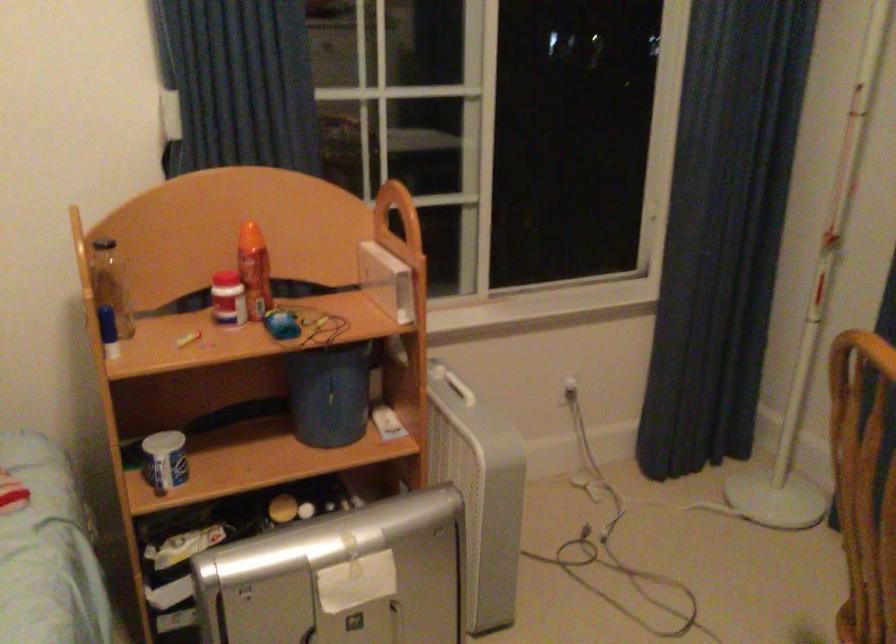
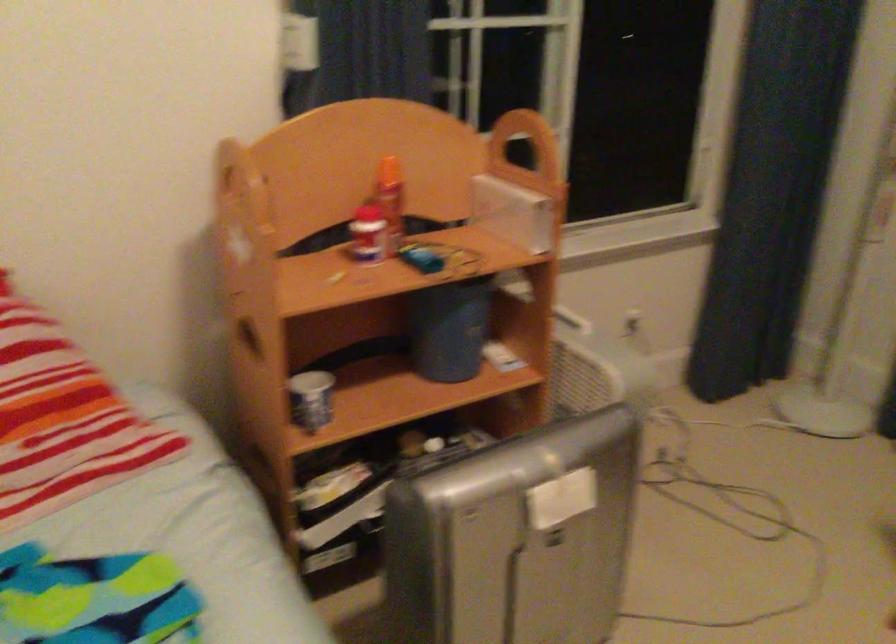
Question: The camera is either moving clockwise (left) or counter-clockwise (right) around the object. The first image is from the beginning of the video and the second image is from the end. Is the camera moving left or right when shooting the video?

Choices:
 (A) Left
 (B) Right

Answer: (A)